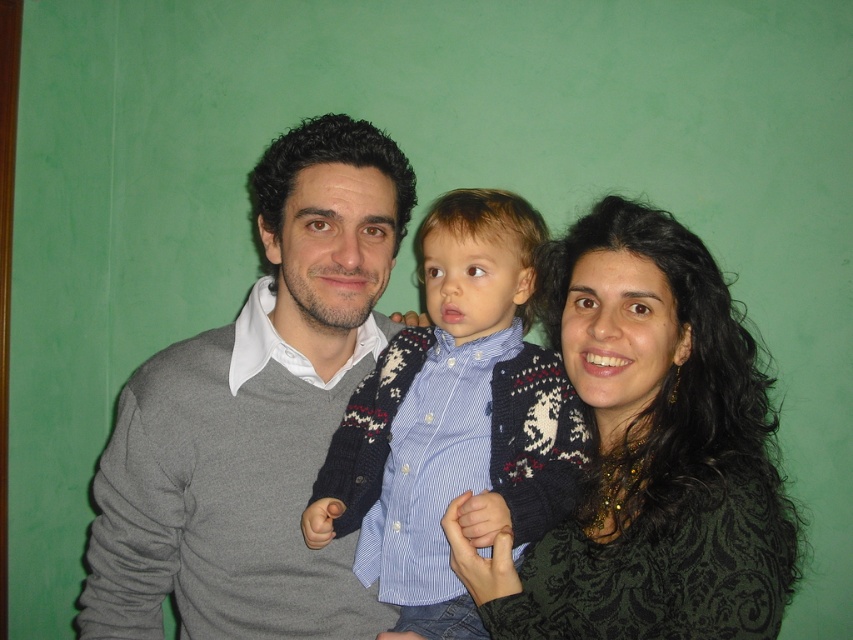
In the scene shown: You are a photographer who wants to ensure that both the gray sweater at center and the knitted sweater at center are in focus. The depth of field in your camera can cover 10 centimeters. Can you capture both sweaters in focus without adjusting the camera settings?

The gray sweater at center and the knitted sweater at center are 12.08 centimeters apart, which exceeds the 10 centimeter depth of field. Therefore, you cannot capture both sweaters in focus without adjusting the camera settings.

You are trying to decide which clothing item to fold first. The knitted sweater at center and the blue striped shirt at center are both on a table. Which one has a larger width?

The knitted sweater at center might be wider than blue striped shirt at center, so it could have a larger width.